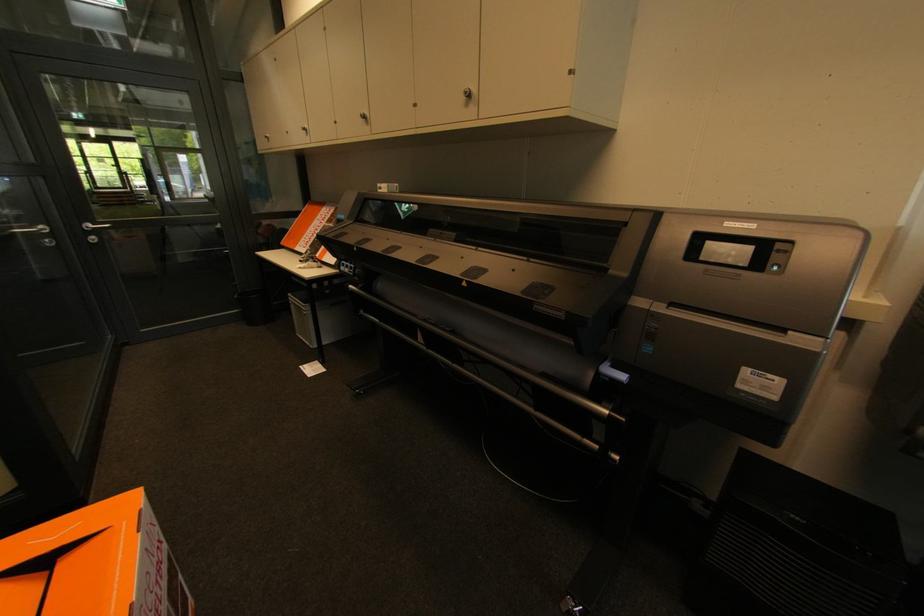
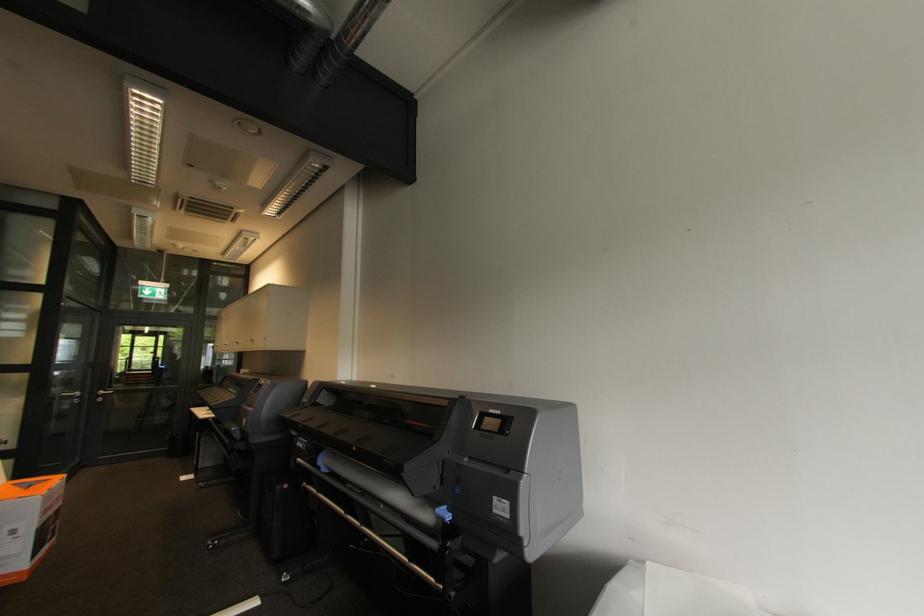
The images are taken continuously from a first-person perspective. In which direction are you moving?

The movement direction of the cameraman is right, backward.